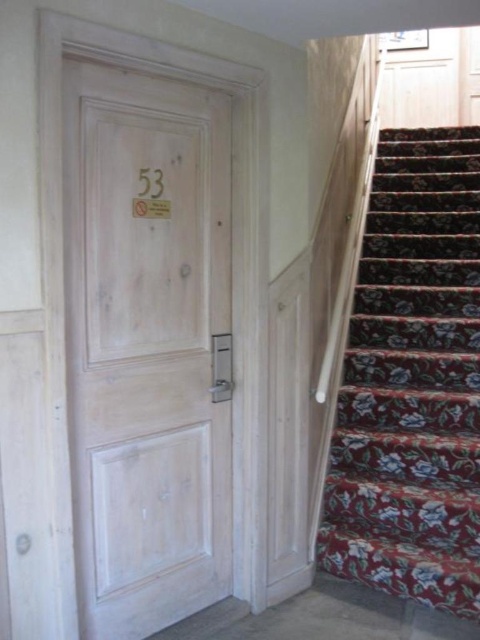
Is white wood door at center to the left of floral carpet at right from the viewer's perspective?

Correct, you'll find white wood door at center to the left of floral carpet at right.

Is point (120, 253) farther from camera compared to point (412, 157)?

No, (120, 253) is closer to viewer.

Is point (153, 292) behind point (377, 355)?

That is False.

Where is `white wood door at center`? The width and height of the screenshot is (480, 640). white wood door at center is located at coordinates (147, 346).